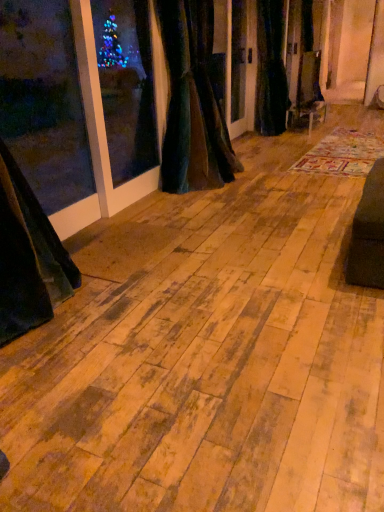
Locate an element on the screen. The width and height of the screenshot is (384, 512). velvet dark green curtain at center, the 1th curtain in the back-to-front sequence is located at coordinates (271, 70).

Describe the element at coordinates (271, 70) in the screenshot. The width and height of the screenshot is (384, 512). I see `velvet dark green curtain at center, which ranks as the 1th curtain in right-to-left order` at that location.

The image size is (384, 512). Identify the location of velvet dark green curtain at center, placed as the second curtain when sorted from right to left. (193, 102).

Considering the relative positions of multicolored woven rug at center and velvet dark green curtain at center, placed as the second curtain when sorted from right to left, in the image provided, is multicolored woven rug at center to the right of velvet dark green curtain at center, placed as the second curtain when sorted from right to left, from the viewer's perspective?

Yes.

Looking at this image, does multicolored woven rug at center turn towards velvet dark green curtain at center, the 1th curtain when ordered from left to right?

No, multicolored woven rug at center is not aimed at velvet dark green curtain at center, the 1th curtain when ordered from left to right.

In the scene shown: Considering the positions of objects multicolored woven rug at center and velvet dark green curtain at center, which is the 1th curtain from front to back, in the image provided, who is behind, multicolored woven rug at center or velvet dark green curtain at center, which is the 1th curtain from front to back,?

multicolored woven rug at center is more distant.

Relative to velvet dark green curtain at center, placed as the second curtain when sorted from right to left, is velvet dark green curtain at center, which ranks as the 1th curtain in right-to-left order, in front or behind?

In the image, velvet dark green curtain at center, which ranks as the 1th curtain in right-to-left order, appears behind velvet dark green curtain at center, placed as the second curtain when sorted from right to left.

Is velvet dark green curtain at center, which is the second curtain in left-to-right order, looking in the opposite direction of velvet dark green curtain at center, the 1th curtain when ordered from left to right?

No, velvet dark green curtain at center, which is the second curtain in left-to-right order, is not facing the opposite direction of velvet dark green curtain at center, the 1th curtain when ordered from left to right.

Is velvet dark green curtain at center, which is counted as the 2th curtain, starting from the back, behind velvet dark green curtain at center, the 1th curtain in the back-to-front sequence?

No, the depth of velvet dark green curtain at center, which is counted as the 2th curtain, starting from the back, is less than that of velvet dark green curtain at center, the 1th curtain in the back-to-front sequence.

Considering the relative sizes of velvet dark green curtain at center, which is counted as the 2th curtain, starting from the back, and velvet dark green curtain at center, which is the second curtain in left-to-right order, in the image provided, is velvet dark green curtain at center, which is counted as the 2th curtain, starting from the back, bigger than velvet dark green curtain at center, which is the second curtain in left-to-right order,?

Indeed, velvet dark green curtain at center, which is counted as the 2th curtain, starting from the back, has a larger size compared to velvet dark green curtain at center, which is the second curtain in left-to-right order.

Measure the distance between velvet dark green curtain at center, placed as the second curtain when sorted from right to left, and velvet dark green curtain at center, which is the second curtain in left-to-right order.

velvet dark green curtain at center, placed as the second curtain when sorted from right to left, and velvet dark green curtain at center, which is the second curtain in left-to-right order, are 5.73 feet apart.

In the scene shown: Is velvet dark green curtain at center, the 1th curtain when ordered from left to right, to the left of velvet dark green curtain at center, which ranks as the 1th curtain in right-to-left order, from the viewer's perspective?

Yes, velvet dark green curtain at center, the 1th curtain when ordered from left to right, is to the left of velvet dark green curtain at center, which ranks as the 1th curtain in right-to-left order.

Can you confirm if multicolored woven rug at center is shorter than velvet dark green curtain at center, which ranks as the 1th curtain in right-to-left order?

Correct, multicolored woven rug at center is not as tall as velvet dark green curtain at center, which ranks as the 1th curtain in right-to-left order.

Where is `curtain that is the 2nd object above the multicolored woven rug at center (from a real-world perspective)`? curtain that is the 2nd object above the multicolored woven rug at center (from a real-world perspective) is located at coordinates (271, 70).

Is point (371, 148) closer or farther from the camera than point (264, 101)?

Point (371, 148) is closer to the camera than point (264, 101).

Is multicolored woven rug at center looking in the opposite direction of velvet dark green curtain at center, marked as the second curtain in a front-to-back arrangement?

No, multicolored woven rug at center is not facing away from velvet dark green curtain at center, marked as the second curtain in a front-to-back arrangement.

Is velvet dark green curtain at center, which is counted as the 2th curtain, starting from the back, completely or partially outside of multicolored woven rug at center?

Yes, velvet dark green curtain at center, which is counted as the 2th curtain, starting from the back, is outside of multicolored woven rug at center.

From a real-world perspective, which object stands above the other?

velvet dark green curtain at center, which is counted as the 2th curtain, starting from the back, is physically above.

Is velvet dark green curtain at center, which is counted as the 2th curtain, starting from the back, positioned with its back to multicolored woven rug at center?

No, velvet dark green curtain at center, which is counted as the 2th curtain, starting from the back,'s orientation is not away from multicolored woven rug at center.

Consider the image. From the image's perspective, does velvet dark green curtain at center, the 1th curtain when ordered from left to right, appear higher than multicolored woven rug at center?

Indeed, from the image's perspective, velvet dark green curtain at center, the 1th curtain when ordered from left to right, is shown above multicolored woven rug at center.

From a real-world perspective, which is physically above, velvet dark green curtain at center, which ranks as the 1th curtain in right-to-left order, or multicolored woven rug at center?

From a 3D spatial view, velvet dark green curtain at center, which ranks as the 1th curtain in right-to-left order, is above.

Which is less distant, (283, 131) or (302, 169)?

The point (302, 169) is closer to the camera.

The image size is (384, 512). In the image, there is a velvet dark green curtain at center, which is the 1th curtain from front to back. In order to click on mat below it (from the image's perspective) in this screenshot , I will do `click(343, 153)`.

At what (x,y) coordinates should I click in order to perform the action: click on curtain on the left of velvet dark green curtain at center, which ranks as the 1th curtain in right-to-left order. Please return your answer as a coordinate pair (x, y). Looking at the image, I should click on pyautogui.click(x=193, y=102).

From the image, which object appears to be farther from multicolored woven rug at center, velvet dark green curtain at center, which is the 1th curtain from front to back, or velvet dark green curtain at center, which ranks as the 1th curtain in right-to-left order?

velvet dark green curtain at center, which is the 1th curtain from front to back, lies further to multicolored woven rug at center than the other object.

Based on their spatial positions, is multicolored woven rug at center or velvet dark green curtain at center, the 1th curtain in the back-to-front sequence, closer to velvet dark green curtain at center, which is counted as the 2th curtain, starting from the back?

The object closer to velvet dark green curtain at center, which is counted as the 2th curtain, starting from the back, is multicolored woven rug at center.

When comparing their distances from velvet dark green curtain at center, marked as the second curtain in a front-to-back arrangement, does velvet dark green curtain at center, which is the 1th curtain from front to back, or multicolored woven rug at center seem closer?

Based on the image, multicolored woven rug at center appears to be nearer to velvet dark green curtain at center, marked as the second curtain in a front-to-back arrangement.

Based on their spatial positions, is velvet dark green curtain at center, marked as the second curtain in a front-to-back arrangement, or velvet dark green curtain at center, which is counted as the 2th curtain, starting from the back, further from multicolored woven rug at center?

velvet dark green curtain at center, which is counted as the 2th curtain, starting from the back.

Considering their positions, is multicolored woven rug at center positioned further to velvet dark green curtain at center, the 1th curtain in the back-to-front sequence, than velvet dark green curtain at center, the 1th curtain when ordered from left to right?

velvet dark green curtain at center, the 1th curtain when ordered from left to right, is positioned further to the anchor velvet dark green curtain at center, the 1th curtain in the back-to-front sequence.

When comparing their distances from velvet dark green curtain at center, placed as the second curtain when sorted from right to left, does velvet dark green curtain at center, which ranks as the 1th curtain in right-to-left order, or multicolored woven rug at center seem closer?

multicolored woven rug at center is positioned closer to the anchor velvet dark green curtain at center, placed as the second curtain when sorted from right to left.

The image size is (384, 512). I want to click on mat located between velvet dark green curtain at center, which is counted as the 2th curtain, starting from the back, and velvet dark green curtain at center, the 1th curtain in the back-to-front sequence, in the depth direction, so click(x=343, y=153).